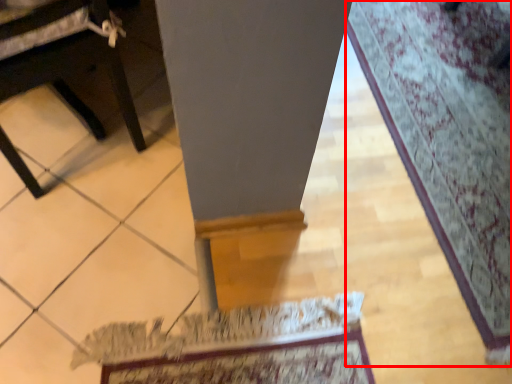
Question: From the image's perspective, where is mat (annotated by the red box) located relative to furniture?

Choices:
 (A) below
 (B) above

Answer: (A)